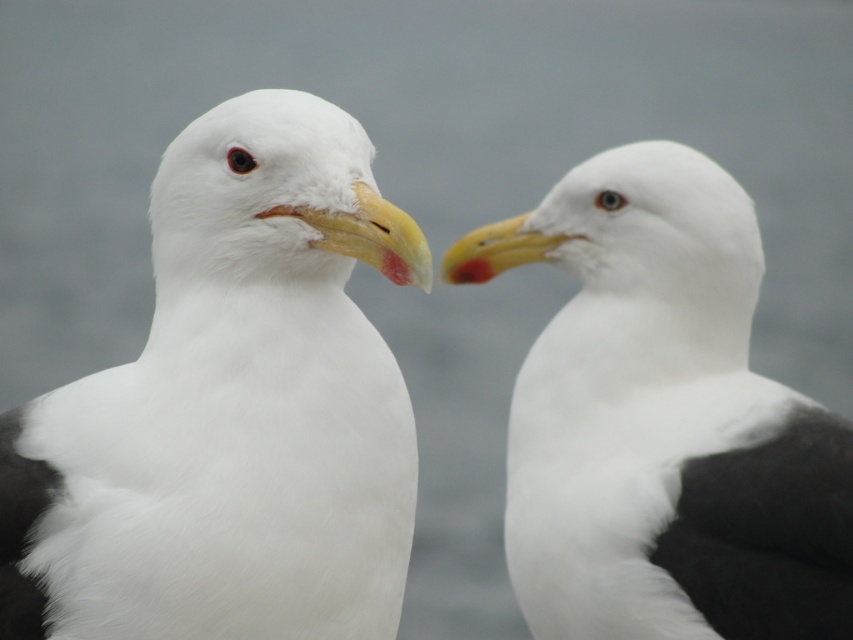
Question: Considering the relative positions of white fluffy seagull at center and white matte seagull at center in the image provided, where is white fluffy seagull at center located with respect to white matte seagull at center?

Choices:
 (A) below
 (B) above

Answer: (B)

Question: Which point appears closest to the camera in this image?

Choices:
 (A) (222, 509)
 (B) (698, 544)

Answer: (A)

Question: Is the position of white fluffy seagull at center less distant than that of white matte seagull at center?

Choices:
 (A) no
 (B) yes

Answer: (B)

Question: Which of the following is the farthest from the observer?

Choices:
 (A) white matte seagull at center
 (B) white fluffy seagull at center

Answer: (A)

Question: Does white fluffy seagull at center have a larger size compared to white matte seagull at center?

Choices:
 (A) yes
 (B) no

Answer: (B)